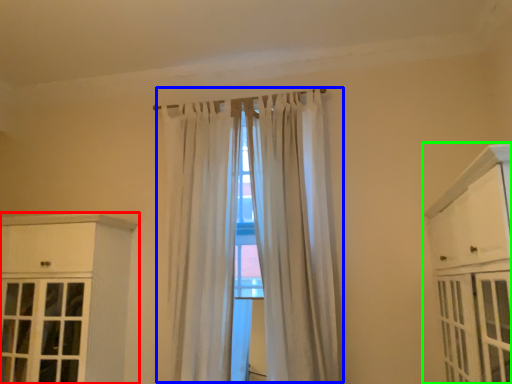
Question: Which object is the closest to the cabinetry (highlighted by a red box)? Choose among these: curtain (highlighted by a blue box) or cabinetry (highlighted by a green box).

Choices:
 (A) curtain
 (B) cabinetry

Answer: (A)